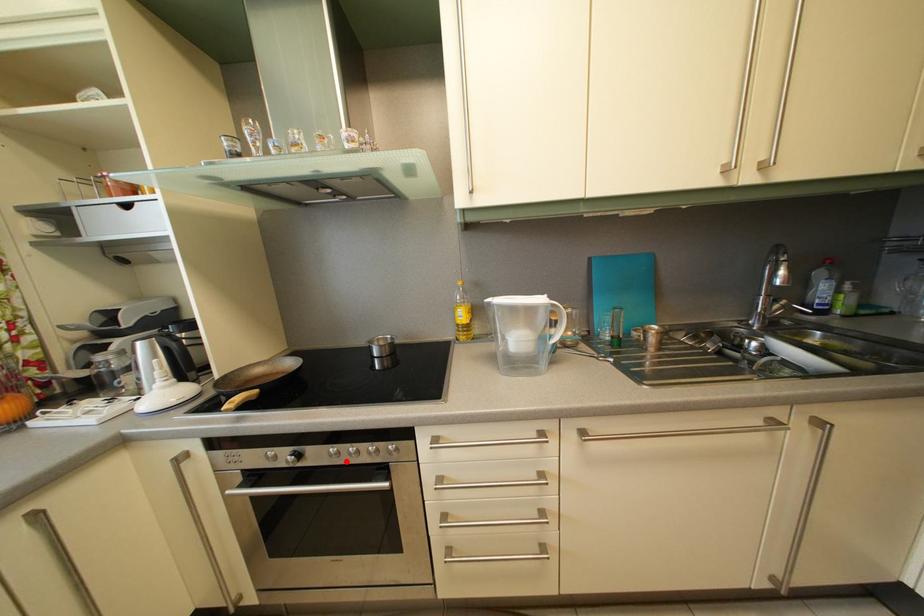
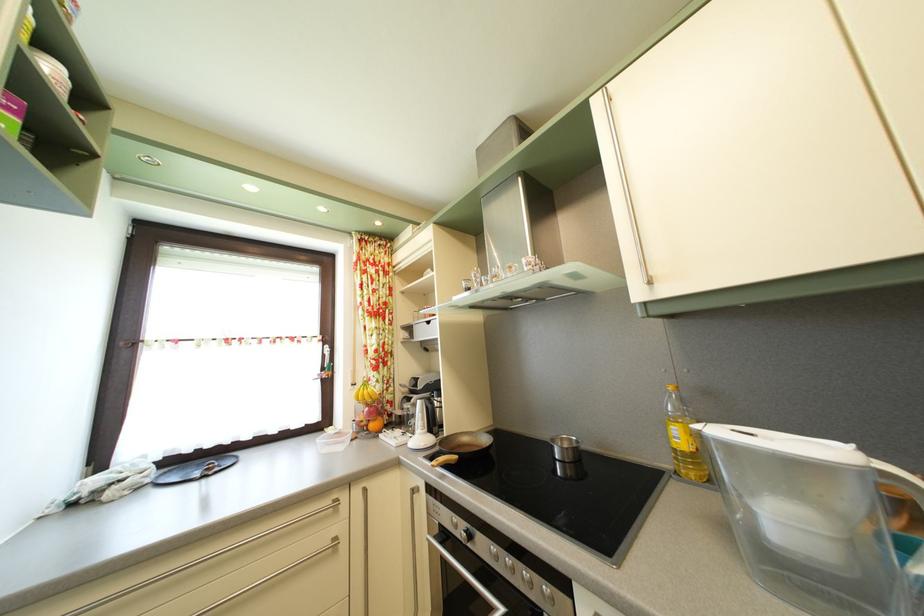
Question: A red point is marked in image1. In image2, is the corresponding 3D point closer to the camera or farther? Reply with the corresponding letter.

Choices:
 (A) The corresponding 3D point is closer.
 (B) The corresponding 3D point is farther.

Answer: (A)